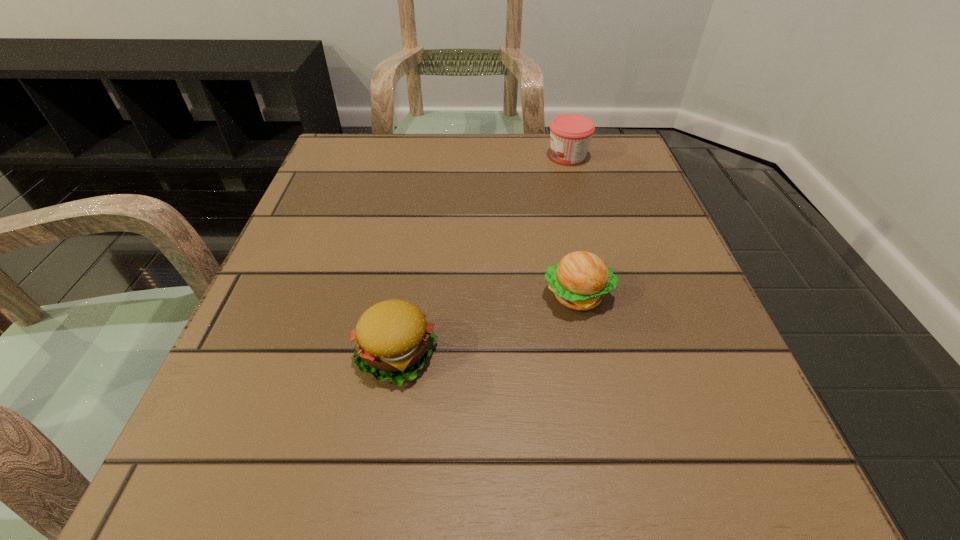
Locate which object ranks second in proximity to the second nearest object. Please provide its 2D coordinates. Your answer should be formatted as a tuple, i.e. [(x, y)], where the tuple contains the x and y coordinates of a point satisfying the conditions above.

[(570, 134)]

Identify the location of object identified as the closest to the second farthest object. (394, 340).

Locate an element on the screen. The image size is (960, 540). free spot that satisfies the following two spatial constraints: 1. on the front label of the farthest object; 2. on the front side of the second farthest object is located at coordinates (606, 295).